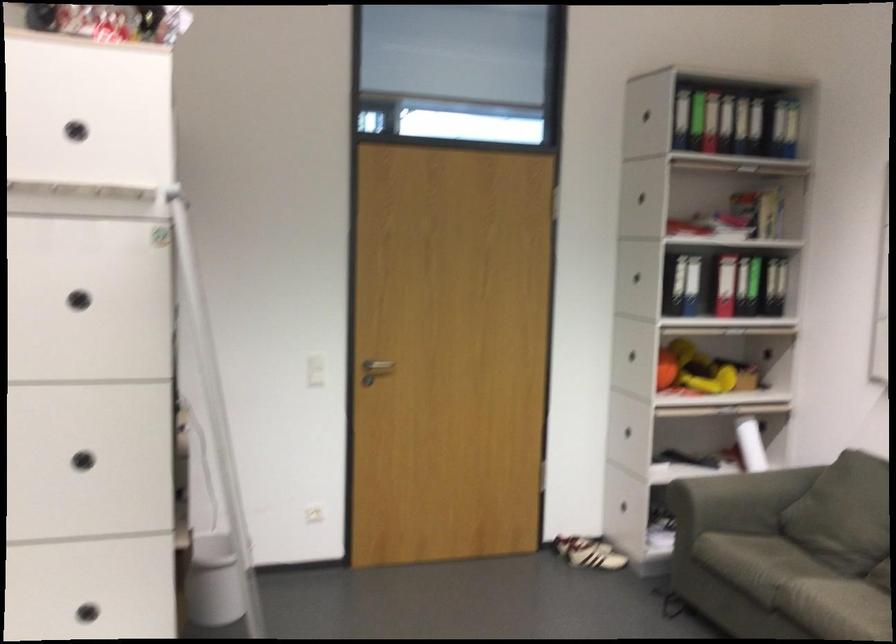
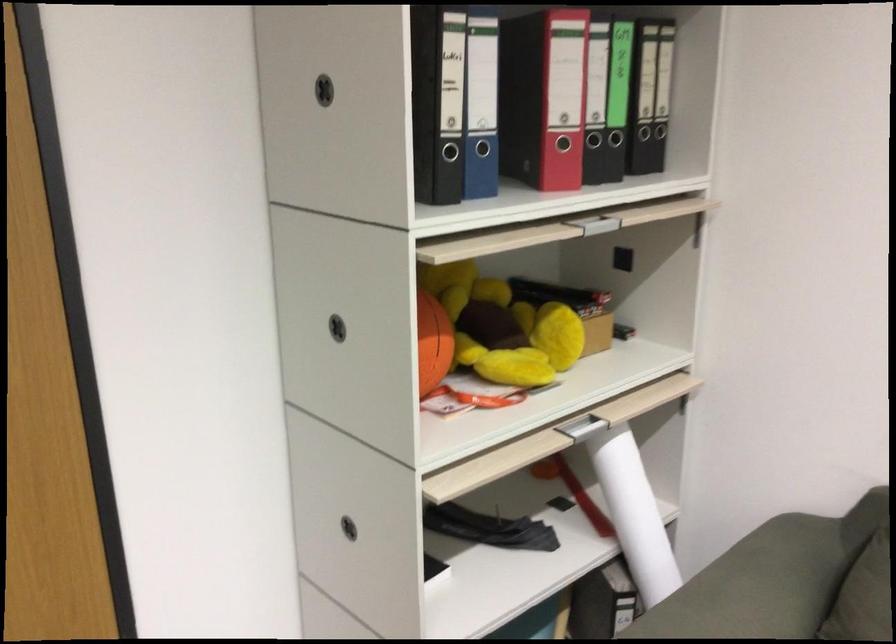
Where in the second image is the point corresponding to point (728, 402) from the first image?

(595, 421)